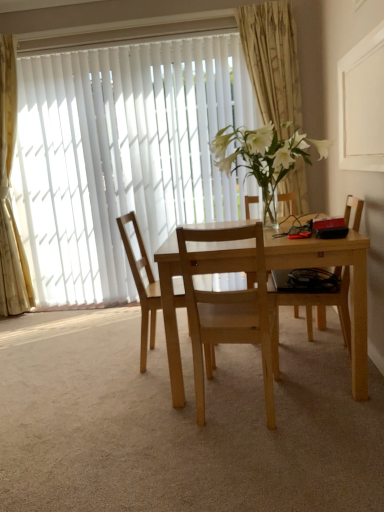
Locate an element on the screen. This screenshot has width=384, height=512. vacant point to the left of natural wood chair at center, placed as the 3th chair when sorted from right to left is located at coordinates (105, 365).